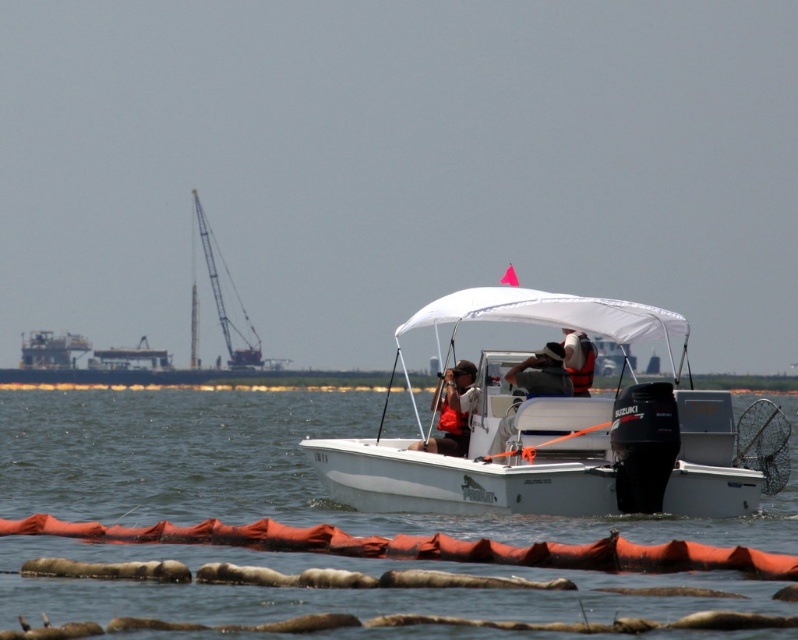
Question: Estimate the real-world distances between objects in this image. Which object is closer to the white smooth water at center?

Choices:
 (A) orange life vest at center
 (B) white life vest at center

Answer: (A)

Question: Is matte orange life vest at center above white life vest at center?

Choices:
 (A) yes
 (B) no

Answer: (B)

Question: Does matte orange life vest at center have a greater width compared to white life vest at center?

Choices:
 (A) no
 (B) yes

Answer: (B)

Question: Among these points, which one is nearest to the camera?

Choices:
 (A) (399, 465)
 (B) (544, 346)
 (C) (441, 378)

Answer: (A)

Question: Is orange life vest at center behind white life vest at center?

Choices:
 (A) no
 (B) yes

Answer: (A)

Question: Which of the following is the farthest from the observer?

Choices:
 (A) matte orange life vest at center
 (B) white matte boat at center
 (C) white life vest at center
 (D) orange life vest at center

Answer: (C)